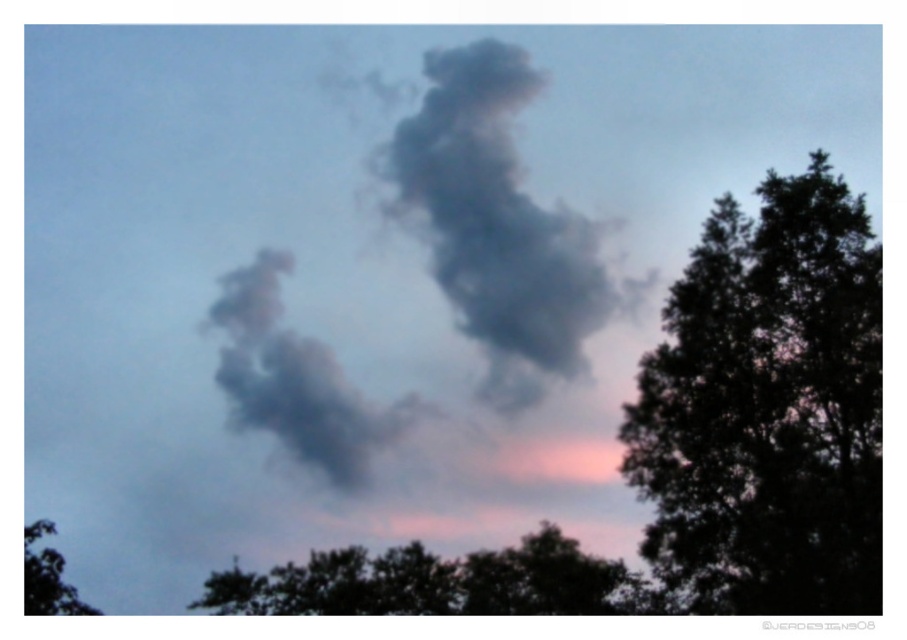
Can you confirm if dark green leafy tree at right is wider than green leafy tree at lower left?

Yes, dark green leafy tree at right is wider than green leafy tree at lower left.

You are a GUI agent. You are given a task and a screenshot of the screen. Output one action in this format:
    pyautogui.click(x=<x>, y=<y>)
    Task: Click on the dark green leafy tree at right
    The image size is (907, 640).
    Given the screenshot: What is the action you would take?
    pyautogui.click(x=768, y=408)

Does gray matte cloud at center have a greater width compared to green leafy tree at lower center?

Incorrect, gray matte cloud at center's width does not surpass green leafy tree at lower center's.

Which is in front, point (502, 276) or point (646, 593)?

Point (502, 276) is in front.

This screenshot has height=640, width=907. I want to click on gray matte cloud at center, so click(498, 225).

Consider the image. Can you confirm if dark green leafy tree at right is wider than green leafy tree at lower center?

No.

Does point (777, 444) lie behind point (639, 576)?

That is False.

I want to click on dark green leafy tree at right, so click(768, 408).